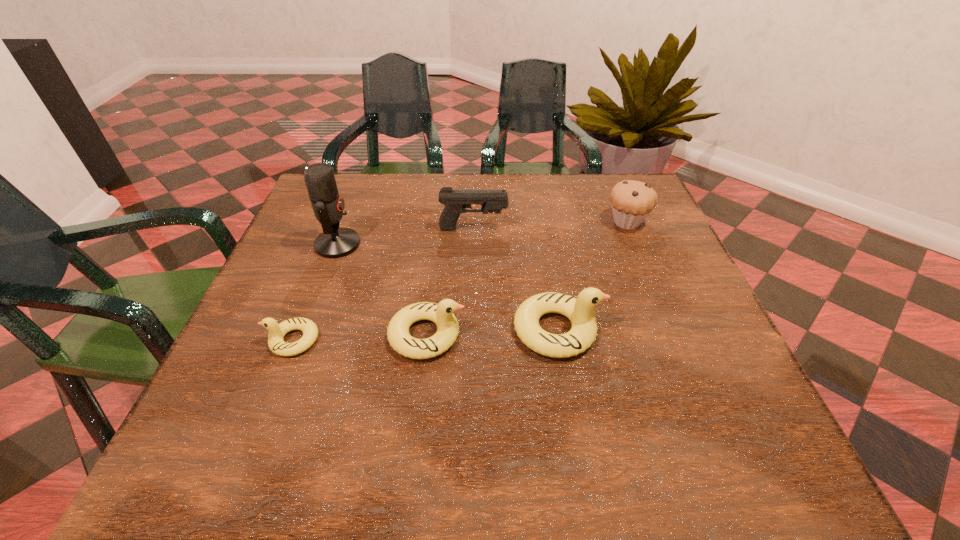
The height and width of the screenshot is (540, 960). What are the coordinates of `vacant region located 0.280m at the barrel of the pistol` in the screenshot? It's located at (618, 229).

Locate an element on the screen. free space located 0.370m on the left of the rightmost object is located at coordinates (460, 222).

Find the location of a particular element. The image size is (960, 540). vacant space located on the side of the tallest object with the red ring is located at coordinates (414, 244).

Where is `object that is at the far edge`? Image resolution: width=960 pixels, height=540 pixels. object that is at the far edge is located at coordinates (631, 201).

I want to click on duckling at the left edge, so click(x=276, y=333).

The width and height of the screenshot is (960, 540). I want to click on microphone that is at the left edge, so click(335, 242).

You are a GUI agent. You are given a task and a screenshot of the screen. Output one action in this format:
    pyautogui.click(x=<x>, y=<y>)
    Task: Click on the object at the right edge
    
    Given the screenshot: What is the action you would take?
    pyautogui.click(x=631, y=201)

The image size is (960, 540). What are the coordinates of `object that is at the far right corner` in the screenshot? It's located at (631, 201).

At what (x,y) coordinates should I click in order to perform the action: click on vacant region at the far edge of the desktop. Please return your answer as a coordinate pair (x, y). Looking at the image, I should click on (393, 179).

In the image, there is a desktop. Where is `vacant space at the near edge`? The image size is (960, 540). vacant space at the near edge is located at coordinates tap(409, 380).